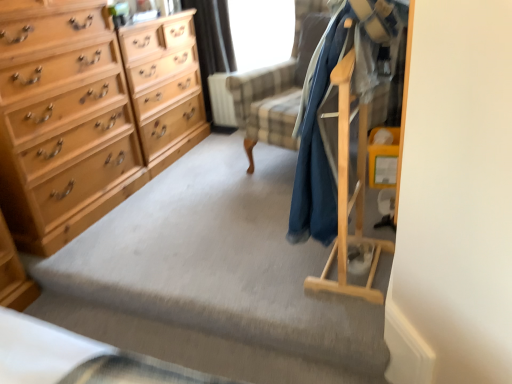
Question: Considering the relative sizes of black fabric curtain at upper center and light wood chest of drawers at left in the image provided, is black fabric curtain at upper center smaller than light wood chest of drawers at left?

Choices:
 (A) yes
 (B) no

Answer: (A)

Question: Is light wood chest of drawers at left completely or partially inside black fabric curtain at upper center?

Choices:
 (A) no
 (B) yes

Answer: (A)

Question: Can you confirm if black fabric curtain at upper center is positioned to the right of light wood chest of drawers at left?

Choices:
 (A) yes
 (B) no

Answer: (A)

Question: Can you confirm if black fabric curtain at upper center is shorter than light wood chest of drawers at left?

Choices:
 (A) yes
 (B) no

Answer: (A)

Question: Is black fabric curtain at upper center outside light wood chest of drawers at left?

Choices:
 (A) yes
 (B) no

Answer: (A)

Question: Do you think black fabric curtain at upper center is within dark blue fabric coat at right, or outside of it?

Choices:
 (A) outside
 (B) inside

Answer: (A)

Question: Is point (211, 41) closer or farther from the camera than point (318, 205)?

Choices:
 (A) farther
 (B) closer

Answer: (A)

Question: Is black fabric curtain at upper center taller or shorter than dark blue fabric coat at right?

Choices:
 (A) short
 (B) tall

Answer: (B)

Question: Looking at their shapes, would you say black fabric curtain at upper center is wider or thinner than dark blue fabric coat at right?

Choices:
 (A) wide
 (B) thin

Answer: (B)

Question: Is light wood/file cabinet at left wider or thinner than transparent plastic window screen at upper center?

Choices:
 (A) wide
 (B) thin

Answer: (A)

Question: Choose the correct answer: Is light wood/file cabinet at left inside transparent plastic window screen at upper center or outside it?

Choices:
 (A) inside
 (B) outside

Answer: (B)

Question: Looking at the image, does light wood/file cabinet at left seem bigger or smaller compared to transparent plastic window screen at upper center?

Choices:
 (A) small
 (B) big

Answer: (B)

Question: From a real-world perspective, is light wood/file cabinet at left above or below transparent plastic window screen at upper center?

Choices:
 (A) above
 (B) below

Answer: (B)

Question: Considering the positions of point (205, 104) and point (112, 54), is point (205, 104) closer or farther from the camera than point (112, 54)?

Choices:
 (A) closer
 (B) farther

Answer: (B)

Question: From a real-world perspective, is black fabric curtain at upper center positioned above or below light wood chest of drawers at left?

Choices:
 (A) below
 (B) above

Answer: (A)